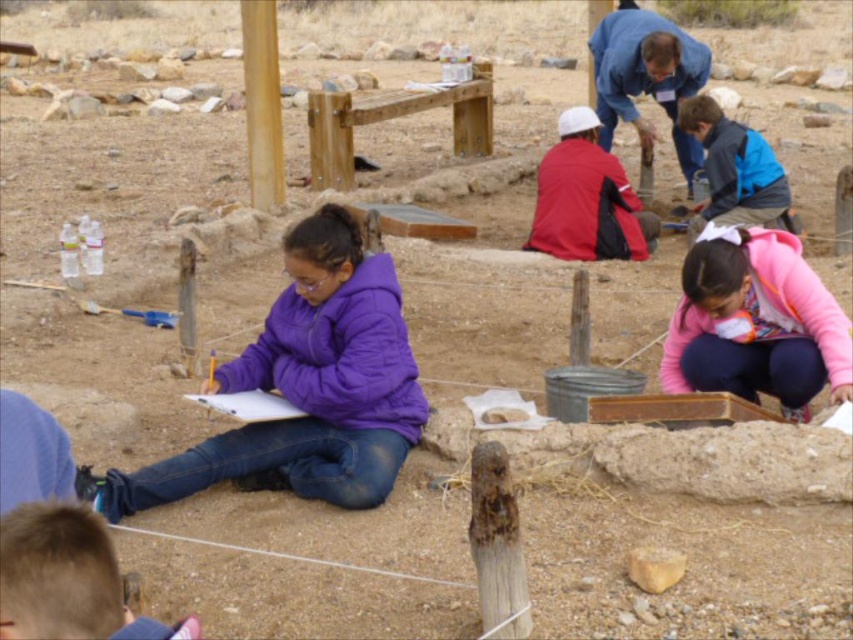
Question: Which of the following is the farthest from the observer?

Choices:
 (A) (668, 376)
 (B) (106, 627)
 (C) (721, 136)

Answer: (C)

Question: Where is purple fleece jacket at center located in relation to red matte jacket at center in the image?

Choices:
 (A) above
 (B) below

Answer: (B)

Question: Among these objects, which one is farthest from the camera?

Choices:
 (A) pink fleece jacket at lower right
 (B) purple fleece jacket at center

Answer: (A)

Question: Does pink fleece jacket at lower right have a greater width compared to blonde hair at lower left?

Choices:
 (A) no
 (B) yes

Answer: (B)

Question: Does blonde hair at lower left lie in front of blue jacket at right?

Choices:
 (A) yes
 (B) no

Answer: (A)

Question: Among these points, which one is nearest to the camera?

Choices:
 (A) (784, 172)
 (B) (7, 556)
 (C) (257, 353)
 (D) (811, 353)

Answer: (B)